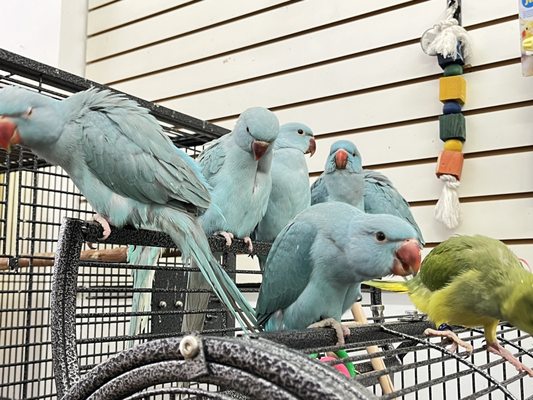
Locate an element on the screen. Image resolution: width=533 pixels, height=400 pixels. wood bead is located at coordinates (453, 109).